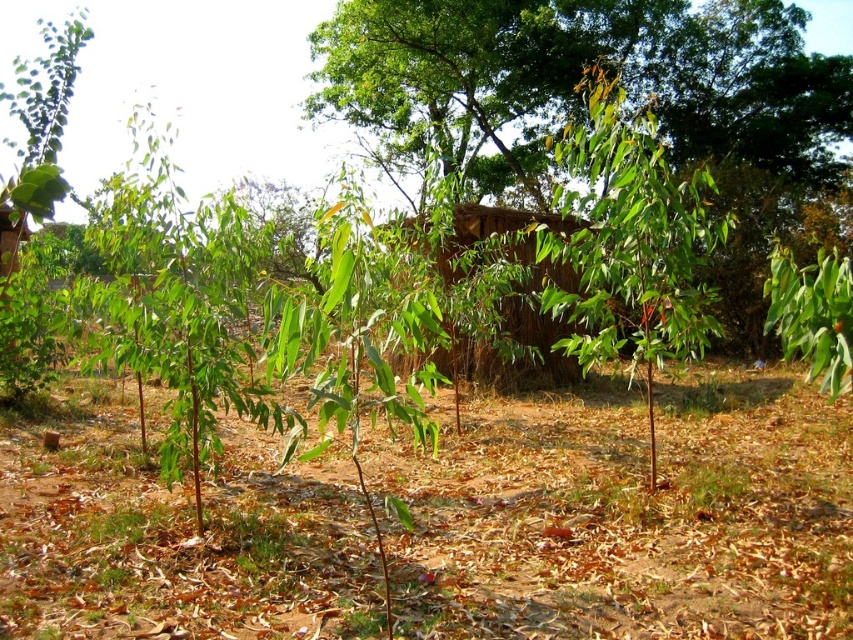
You are a gardener planning to water the green leafy plant at center and the brown soil at center. Which one should you water first if you want to reach the plant that is closer to you?

The brown soil at center is closer to you than the green leafy plant at center, so you should water the brown soil at center first.

You are a traveler who wants to take shelter from the rain. You see the green leafy tree at center and the brown thatch hut at center. Which one would provide better protection from the rain?

The brown thatch hut at center is a structure designed for shelter, so it would provide better protection from the rain compared to the green leafy tree at center.